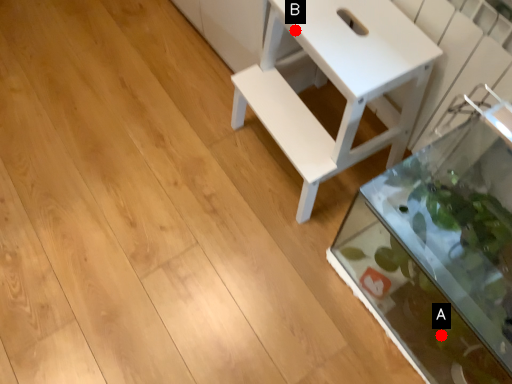
Question: Two points are circled on the image, labeled by A and B beside each circle. Which point is farther to the camera?

Choices:
 (A) A is further
 (B) B is further

Answer: (A)